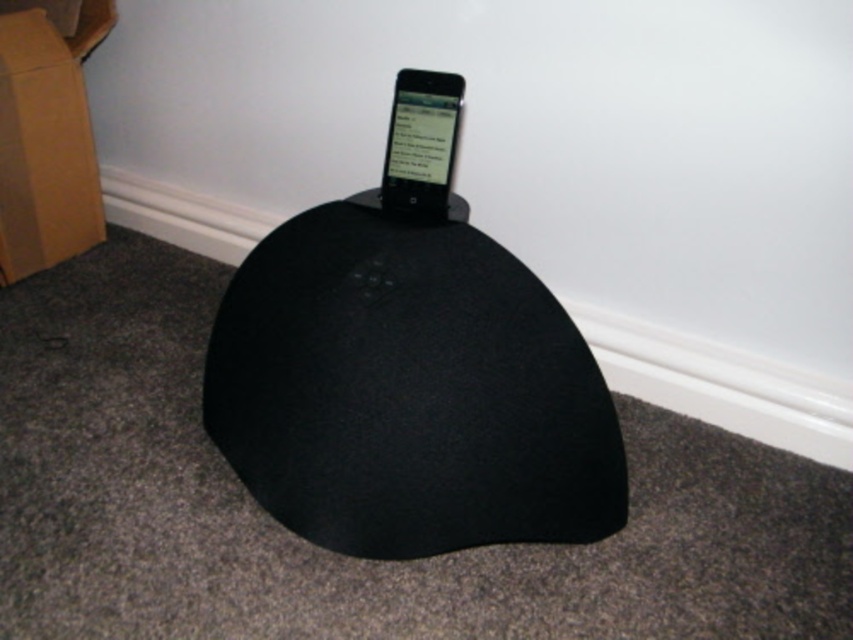
Question: Which object is positioned closest to the brown cardboard at left?

Choices:
 (A) matte black phone at center
 (B) black fabric bean bag at center

Answer: (A)

Question: From the image, what is the correct spatial relationship of black fabric bean bag at center in relation to matte black phone at center?

Choices:
 (A) below
 (B) above

Answer: (A)

Question: Among these points, which one is farthest from the camera?

Choices:
 (A) (440, 204)
 (B) (602, 444)

Answer: (A)

Question: Can you confirm if black fabric bean bag at center is smaller than brown cardboard at left?

Choices:
 (A) no
 (B) yes

Answer: (A)

Question: Does black fabric bean bag at center appear over matte black phone at center?

Choices:
 (A) yes
 (B) no

Answer: (B)

Question: Estimate the real-world distances between objects in this image. Which object is closer to the black fabric bean bag at center?

Choices:
 (A) brown cardboard at left
 (B) matte black phone at center

Answer: (B)